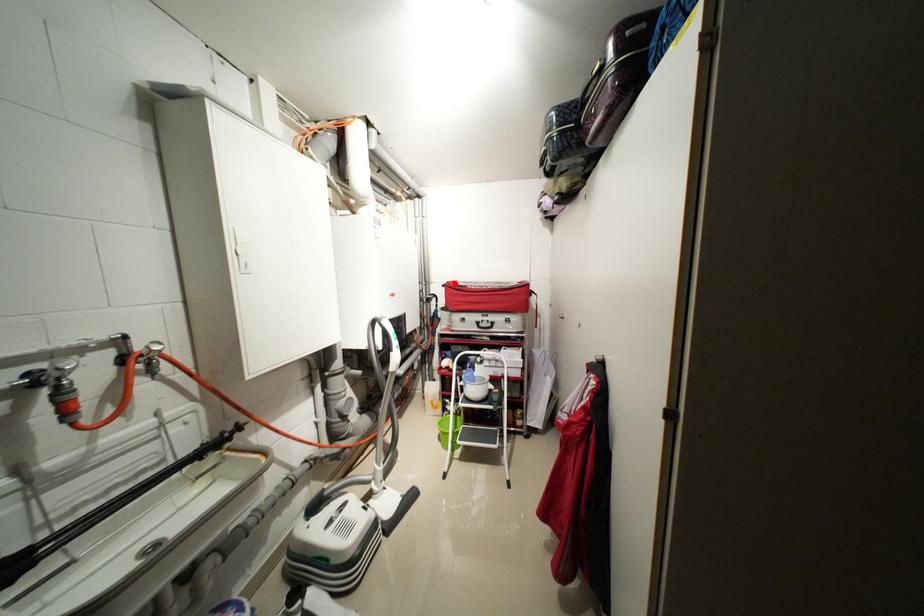
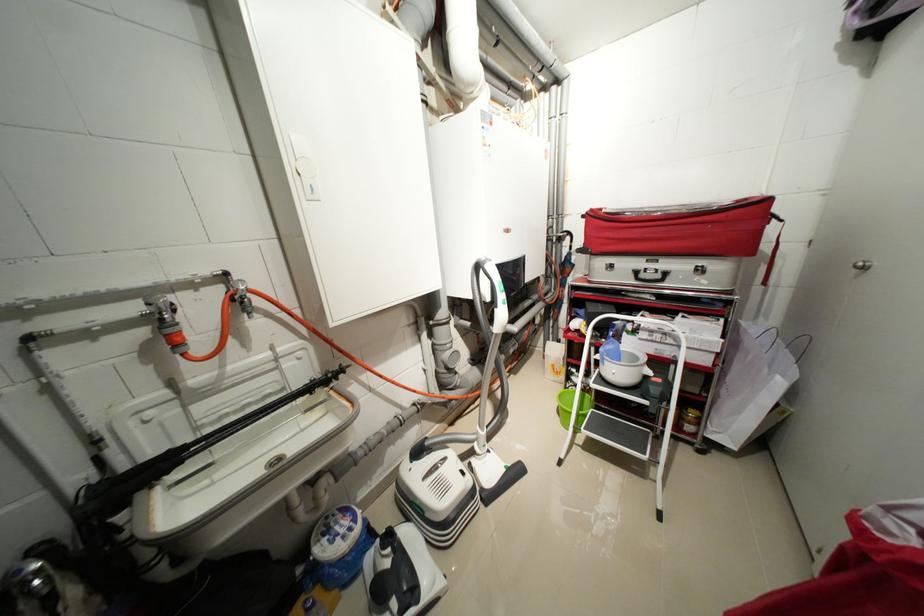
The point at the highlighted location is marked in the first image. Where is the corresponding point in the second image?

(599, 211)